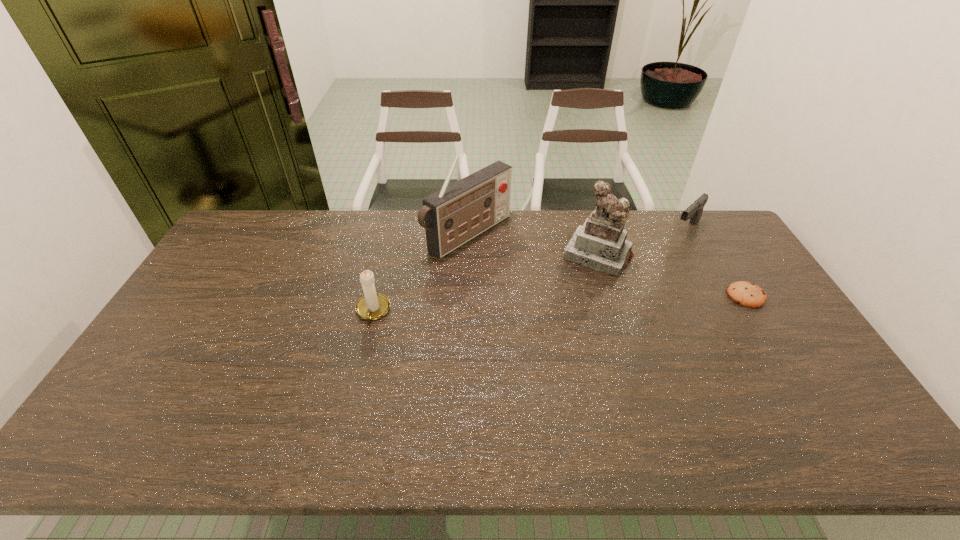
Locate an element on the screen. free space that satisfies the following two spatial constraints: 1. on the front side of the third object from left to right; 2. on the left side of the radio receiver is located at coordinates (468, 255).

This screenshot has height=540, width=960. I want to click on vacant space that satisfies the following two spatial constraints: 1. on the front side of the shortest object; 2. on the right side of the third object from left to right, so click(611, 296).

Image resolution: width=960 pixels, height=540 pixels. In order to click on vacant space that satisfies the following two spatial constraints: 1. on the front side of the shortest object; 2. on the left side of the second object from left to right in this screenshot , I will do `click(467, 296)`.